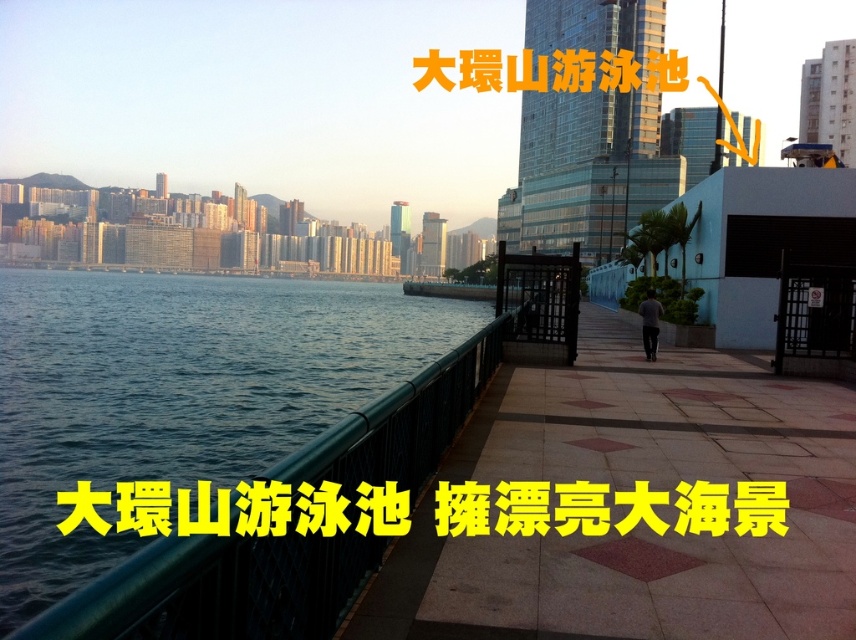
Based on the photo, does green metal railing at left appear on the right side of yellow text at upper center?

Indeed, green metal railing at left is positioned on the right side of yellow text at upper center.

Can you confirm if green metal railing at left is positioned below yellow text at upper center?

Actually, green metal railing at left is above yellow text at upper center.

Where is `green metal railing at left`? The width and height of the screenshot is (856, 640). green metal railing at left is located at coordinates (629, 486).

Locate an element on the screen. This screenshot has width=856, height=640. green metal railing at left is located at coordinates (629, 486).

Can you confirm if green metal railing at left is shorter than green metallic railing at lower left?

Indeed, green metal railing at left has a lesser height compared to green metallic railing at lower left.

Consider the image. Is green metal railing at left thinner than green metallic railing at lower left?

Yes, green metal railing at left is thinner than green metallic railing at lower left.

Measure the distance between green metal railing at left and camera.

11.98 feet

Identify the location of green metal railing at left. The image size is (856, 640). (629, 486).

Is green metallic railing at lower left further to the viewer compared to yellow text at upper center?

Yes, green metallic railing at lower left is behind yellow text at upper center.

Is green metallic railing at lower left taller than yellow text at upper center?

Yes.

Locate an element on the screen. The height and width of the screenshot is (640, 856). green metallic railing at lower left is located at coordinates (x=176, y=390).